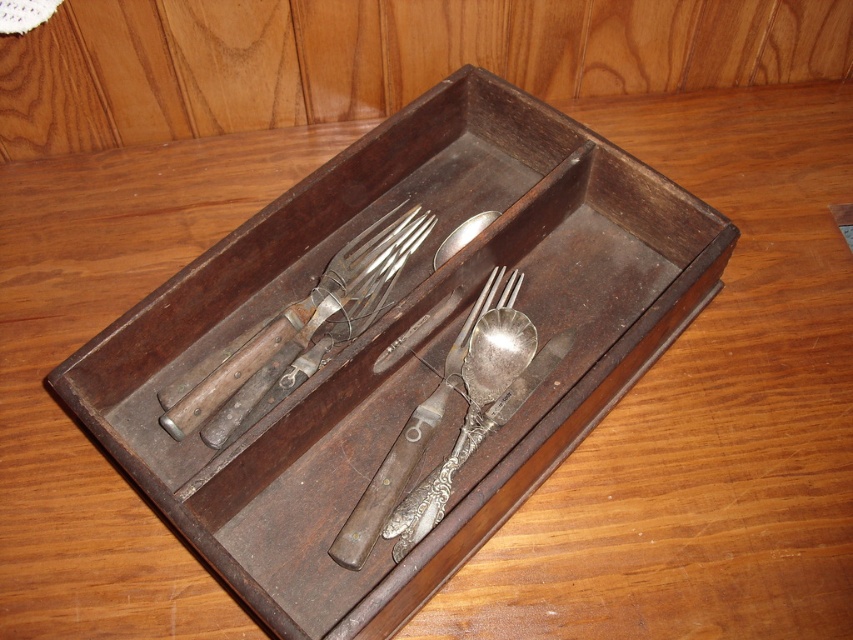
Question: Can you confirm if wooden-handled fork at center is positioned below silver polished spoon at center?

Choices:
 (A) no
 (B) yes

Answer: (A)

Question: Which is nearer to the wooden tray at center?

Choices:
 (A) polished silver spoon at center
 (B) silver polished spoon at center
 (C) wooden-handled fork at center

Answer: (C)

Question: From the image, what is the correct spatial relationship of wooden-handled fork at center in relation to polished silver spoon at center?

Choices:
 (A) above
 (B) below

Answer: (B)

Question: Estimate the real-world distances between objects in this image. Which object is farther from the wooden-handled fork at center?

Choices:
 (A) silver polished spoon at center
 (B) wooden tray at center
 (C) polished silver spoon at center

Answer: (C)

Question: Which of these objects is positioned farthest from the wooden tray at center?

Choices:
 (A) silver polished spoon at center
 (B) polished silver spoon at center

Answer: (B)

Question: Is wooden tray at center smaller than polished silver spoon at center?

Choices:
 (A) yes
 (B) no

Answer: (B)